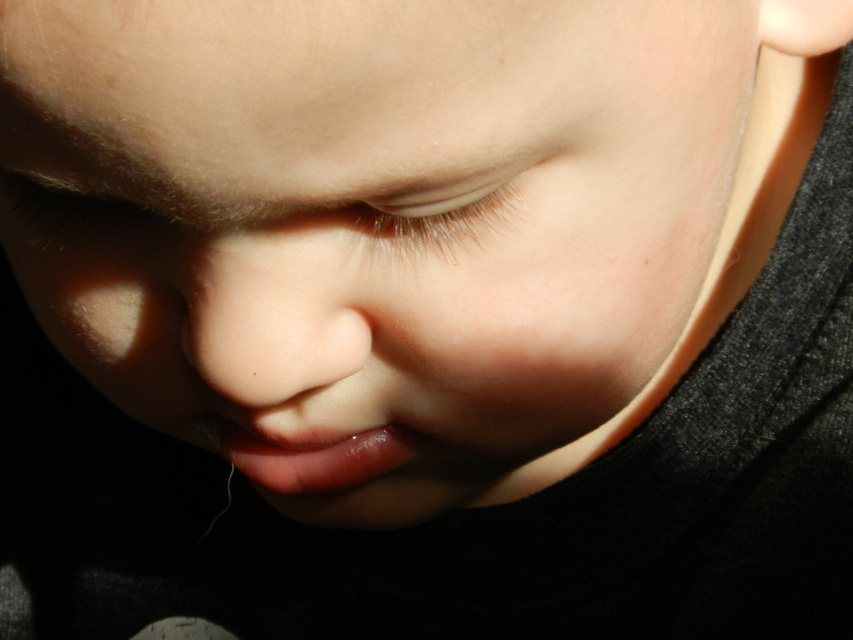
Based on the coordinates provided in the scene description, can you determine the exact position of the smooth flesh nose at center?

The smooth flesh nose at center is located at point coordinates of (x=274, y=314).

You are a dermatologist examining a closeup of a child face. You see the smooth flesh nose at center and the translucent skin at center. Which one is located to the left?

The smooth flesh nose at center is to the left of translucent skin at center.

Based on the scene description, which object is larger in size between the translucent skin at center and the glossy pink lips at center?

The glossy pink lips at center are larger than the translucent skin at center.